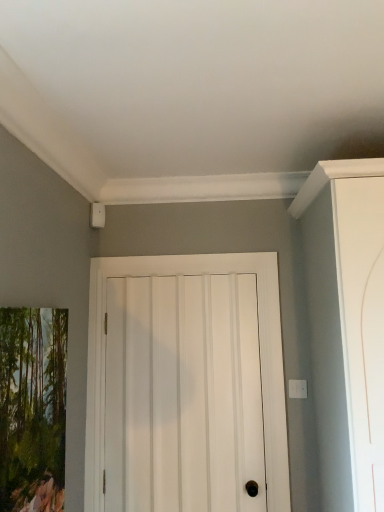
Question: From the image's perspective, is white matte door at center above or below matte wooden picture frame at left?

Choices:
 (A) below
 (B) above

Answer: (A)

Question: In the image, is white matte door at center positioned in front of or behind matte wooden picture frame at left?

Choices:
 (A) front
 (B) behind

Answer: (B)

Question: From a real-world perspective, is white matte door at center positioned above or below matte wooden picture frame at left?

Choices:
 (A) below
 (B) above

Answer: (A)

Question: In the image, is matte wooden picture frame at left on the left side or the right side of white matte door at center?

Choices:
 (A) right
 (B) left

Answer: (B)

Question: In terms of height, does matte wooden picture frame at left look taller or shorter compared to white matte door at center?

Choices:
 (A) short
 (B) tall

Answer: (A)

Question: Relative to white matte door at center, is matte wooden picture frame at left in front or behind?

Choices:
 (A) front
 (B) behind

Answer: (A)

Question: Is matte wooden picture frame at left wider or thinner than white matte door at center?

Choices:
 (A) thin
 (B) wide

Answer: (B)